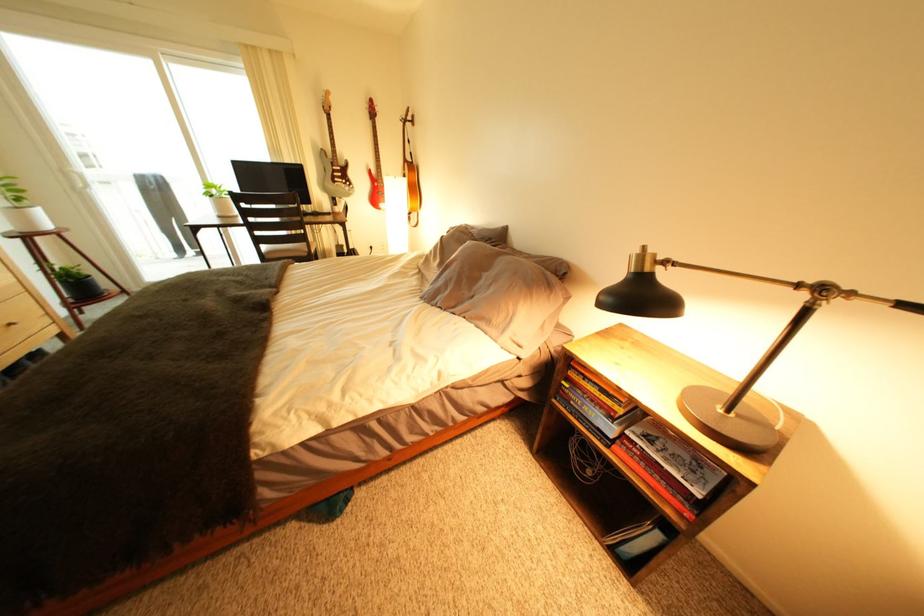
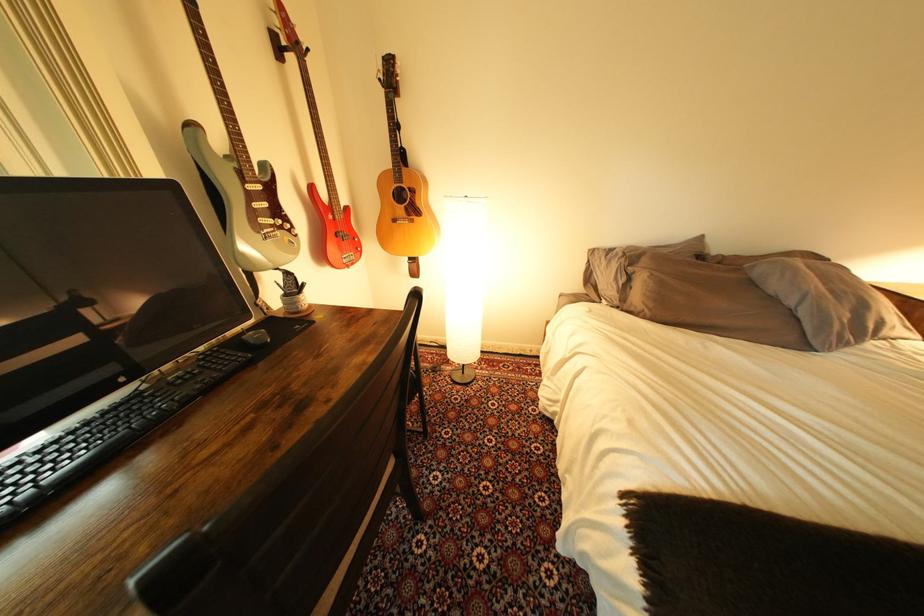
The point at (349, 185) is marked in the first image. Where is the corresponding point in the second image?

(278, 233)